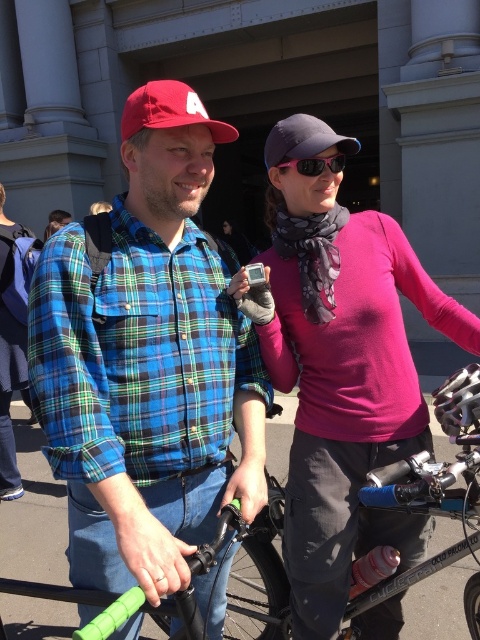
You are standing at the origin of a coordinate system placed at the bottom left corner of the image. You see a point labeled at coordinates (343,380). What object is located at that point?

The point at coordinates (343,380) corresponds to the pink matte sweater at center.

Looking at this image, you are a fashion designer observing the image and want to create a new outfit that matches the pink matte sweater at center and the pink matte sunglasses at upper center. Which item should you consider the width of to ensure proper coordination?

The pink matte sweater at center is wider than the pink matte sunglasses at upper center, so you should consider the width of the pink matte sweater at center to ensure proper coordination.